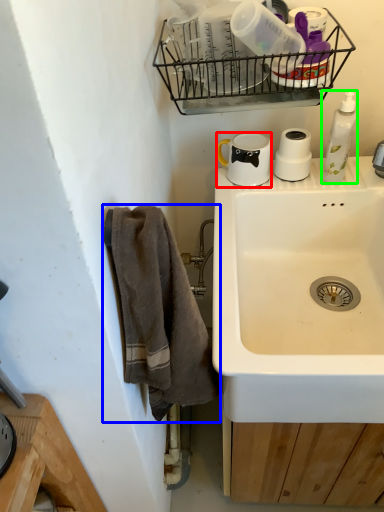
Question: Which object is the farthest from coffee cup (highlighted by a red box)? Choose among these: towel/napkin (highlighted by a blue box) or cleaning product (highlighted by a green box).

Choices:
 (A) towel/napkin
 (B) cleaning product

Answer: (A)